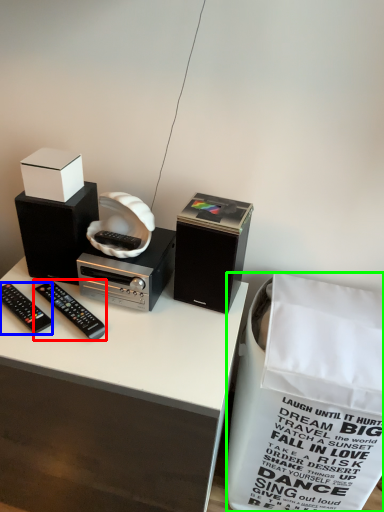
Question: Considering the real-world distances, which object is farthest from remote control (highlighted by a red box)? remote control (highlighted by a blue box) or shopping bag (highlighted by a green box)?

Choices:
 (A) remote control
 (B) shopping bag

Answer: (B)